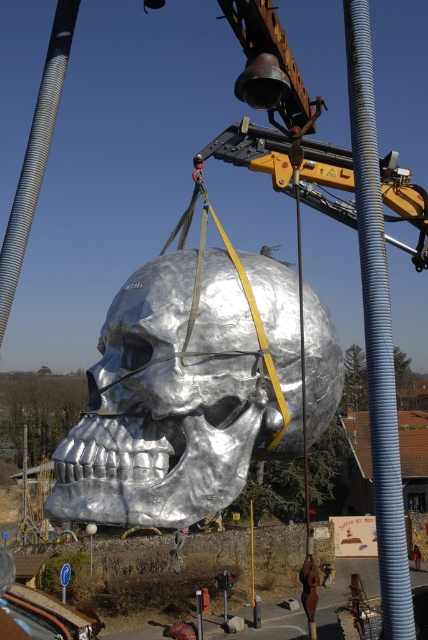
You are standing at the base of the crane looking up at the two points marked in the scene. Which point, point (281, 378) or point (416, 554), is closer to you?

Point (281, 378) is in front of point (416, 554), so it is closer to you.

You are a construction supervisor observing the scene. There is a gray corrugated pipe at center and a brushed metal construction worker at lower center. Which object is located above the other?

The gray corrugated pipe at center is positioned over the brushed metal construction worker at lower center, meaning it is above the worker.

You are standing at the base of the crane and looking up. Where is the shiny metallic skull at center located relative to your position?

The shiny metallic skull at center is located at point (168, 401) relative to your position at the base of the crane.